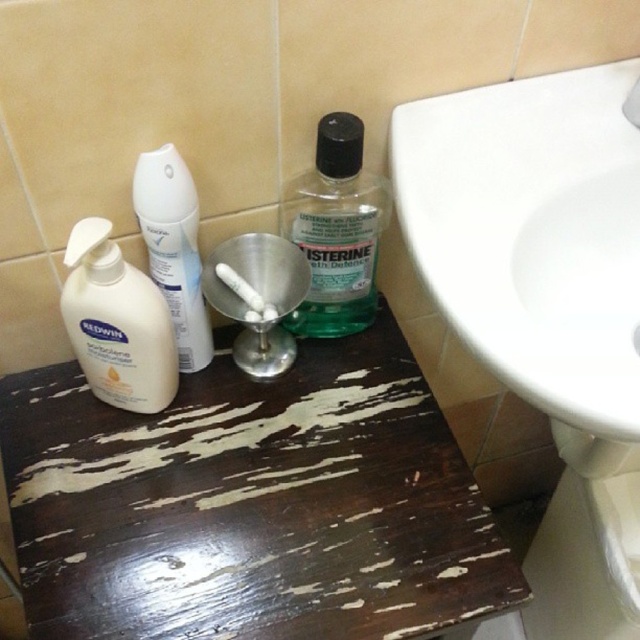
You are trying to place a new toothbrush holder between the dark wood table at center and the white glossy sink at upper right. Based on their positions, where should you place it?

The dark wood table at center is located below the white glossy sink at upper right, so you should place the toothbrush holder between them in the space between the dark wood table at center and the white glossy sink at upper right, below the sink and above the table.

You are organizing a bathroom shelf and need to place the green translucent plastic mouthwash at center and the white matte lotion at left. Which one requires a narrower space for placement?

The green translucent plastic mouthwash at center is thinner than the white matte lotion at left, so it requires a narrower space for placement.

You are organizing items on a bathroom counter and need to place a new toothbrush holder. The current items include the green translucent plastic mouthwash at center. Where should you place the toothbrush holder to avoid blocking the mouthwash?

The green translucent plastic mouthwash at center is located at point [336,230], so placing the toothbrush holder away from this coordinate will ensure it doesn not block the mouthwash.